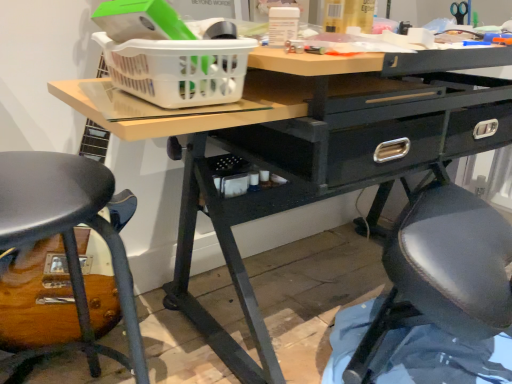
Question: Does white plastic basket at upper center appear on the left side of matte black stool at lower left?

Choices:
 (A) no
 (B) yes

Answer: (A)

Question: Is white plastic basket at upper center positioned far away from matte black stool at lower left?

Choices:
 (A) no
 (B) yes

Answer: (A)

Question: From the image's perspective, would you say white plastic basket at upper center is positioned over matte black stool at lower left?

Choices:
 (A) no
 (B) yes

Answer: (B)

Question: From a real-world perspective, is white plastic basket at upper center positioned under matte black stool at lower left based on gravity?

Choices:
 (A) yes
 (B) no

Answer: (B)

Question: From the image's perspective, is white plastic basket at upper center below matte black stool at lower left?

Choices:
 (A) no
 (B) yes

Answer: (A)

Question: From a real-world perspective, is white plastic basket at upper center located higher than matte black stool at lower left?

Choices:
 (A) yes
 (B) no

Answer: (A)

Question: Is matte black stool at lower left completely or partially outside of white plastic basket at upper center?

Choices:
 (A) yes
 (B) no

Answer: (A)

Question: Is white plastic basket at upper center located within matte black stool at lower left?

Choices:
 (A) yes
 (B) no

Answer: (B)

Question: From the image's perspective, is matte black stool at lower left located beneath white plastic basket at upper center?

Choices:
 (A) no
 (B) yes

Answer: (B)

Question: Can you confirm if matte black stool at lower left is taller than white plastic basket at upper center?

Choices:
 (A) no
 (B) yes

Answer: (B)

Question: Considering the relative positions of matte black stool at lower left and white plastic basket at upper center in the image provided, is matte black stool at lower left behind white plastic basket at upper center?

Choices:
 (A) no
 (B) yes

Answer: (A)

Question: Can you confirm if matte black stool at lower left is shorter than white plastic basket at upper center?

Choices:
 (A) yes
 (B) no

Answer: (B)

Question: Looking at the image, does matte black stool at lower left seem bigger or smaller compared to white plastic basket at upper center?

Choices:
 (A) big
 (B) small

Answer: (A)